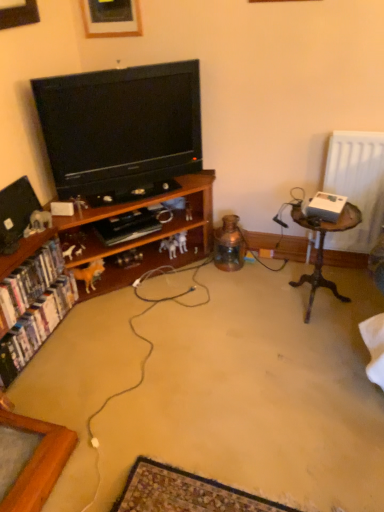
Question: Considering the relative sizes of wooden picture frame at upper center and wooden cabinet at left in the image provided, is wooden picture frame at upper center taller than wooden cabinet at left?

Choices:
 (A) no
 (B) yes

Answer: (A)

Question: Is wooden picture frame at upper center closer to camera compared to wooden cabinet at left?

Choices:
 (A) no
 (B) yes

Answer: (A)

Question: Does wooden picture frame at upper center turn towards wooden cabinet at left?

Choices:
 (A) no
 (B) yes

Answer: (A)

Question: Does wooden picture frame at upper center appear on the right side of wooden cabinet at left?

Choices:
 (A) yes
 (B) no

Answer: (B)

Question: From a real-world perspective, is wooden picture frame at upper center on wooden cabinet at left?

Choices:
 (A) no
 (B) yes

Answer: (B)

Question: From the image's perspective, relative to woodenobject at right, is wooden cabinet at left above or below?

Choices:
 (A) below
 (B) above

Answer: (A)

Question: Considering the positions of wooden cabinet at left and woodenobject at right in the image, is wooden cabinet at left taller or shorter than woodenobject at right?

Choices:
 (A) tall
 (B) short

Answer: (B)

Question: From a real-world perspective, relative to woodenobject at right, is wooden cabinet at left vertically above or below?

Choices:
 (A) above
 (B) below

Answer: (A)

Question: Looking at their shapes, would you say wooden cabinet at left is wider or thinner than woodenobject at right?

Choices:
 (A) wide
 (B) thin

Answer: (A)

Question: Does point (8, 226) appear closer or farther from the camera than point (51, 270)?

Choices:
 (A) closer
 (B) farther

Answer: (A)

Question: Would you say matte black television at left, positioned as the 1th television in left-to-right order, is inside or outside white glossy bookshelf at lower left, which is the second book in top-to-bottom order?

Choices:
 (A) outside
 (B) inside

Answer: (A)

Question: Considering the positions of matte black television at left, positioned as the 1th television in left-to-right order, and white glossy bookshelf at lower left, the first book in the bottom-to-top sequence, in the image, is matte black television at left, positioned as the 1th television in left-to-right order, taller or shorter than white glossy bookshelf at lower left, the first book in the bottom-to-top sequence,?

Choices:
 (A) short
 (B) tall

Answer: (B)

Question: From a real-world perspective, is matte black television at left, the second television from the right, above or below white glossy bookshelf at lower left, the first book in the bottom-to-top sequence?

Choices:
 (A) above
 (B) below

Answer: (A)

Question: Would you say wooden picture frame at upper center is to the left or to the right of black glossy television at center, which ranks as the 1th television in right-to-left order, in the picture?

Choices:
 (A) right
 (B) left

Answer: (B)

Question: From a real-world perspective, is wooden picture frame at upper center positioned above or below black glossy television at center, which ranks as the 1th television in right-to-left order?

Choices:
 (A) above
 (B) below

Answer: (A)